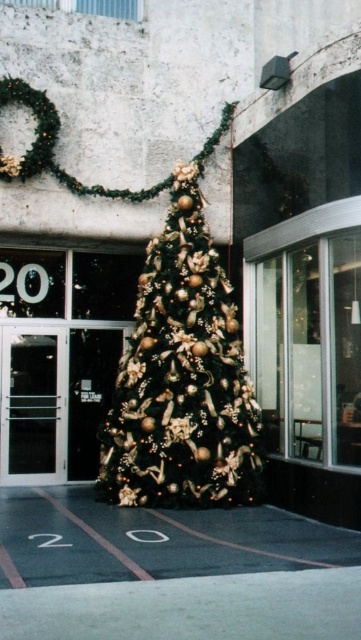
Does shiny gold christmas tree at center have a greater height compared to transparent glass door at left?

Yes.

Is shiny gold christmas tree at center positioned in front of transparent glass door at left?

Yes, it is in front of transparent glass door at left.

This screenshot has height=640, width=361. Describe the element at coordinates (181, 378) in the screenshot. I see `shiny gold christmas tree at center` at that location.

Identify the location of shiny gold christmas tree at center. This screenshot has height=640, width=361. (181, 378).